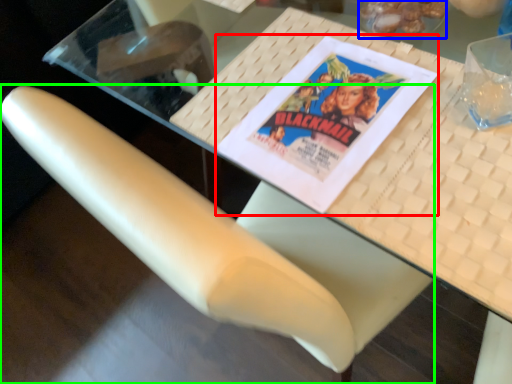
Question: Based on their relative distances, which object is nearer to paperback book (highlighted by a red box)? Choose from food (highlighted by a blue box) and chair (highlighted by a green box).

Choices:
 (A) food
 (B) chair

Answer: (A)